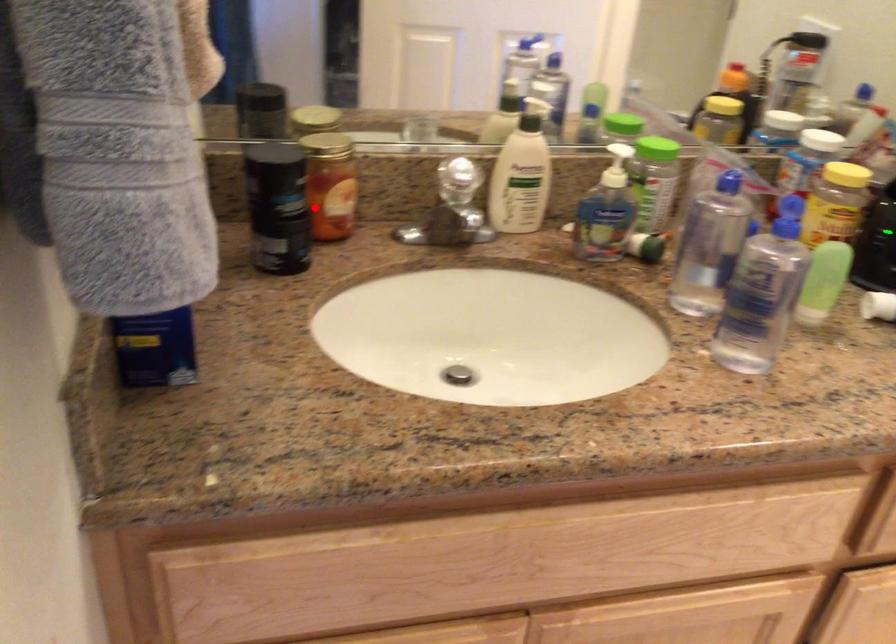
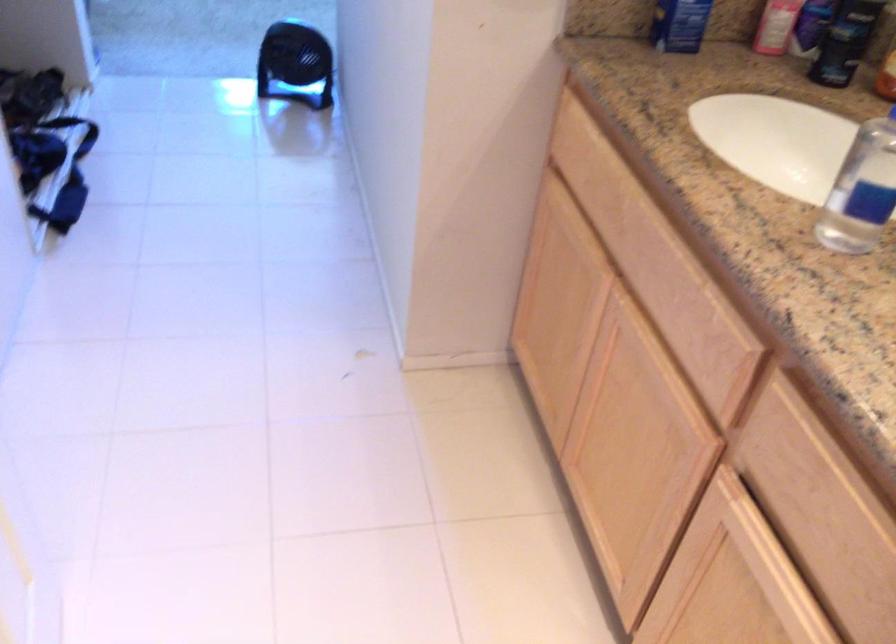
In the second image, find the point that corresponds to the highlighted location in the first image.

(845, 41)